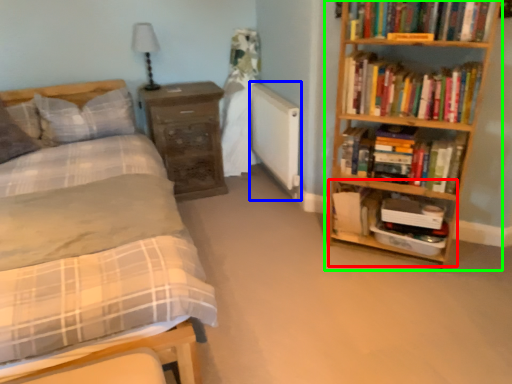
Question: Based on their relative distances, which object is nearer to cabinet (highlighted by a red box)? Choose from radiator (highlighted by a blue box) and bookcase (highlighted by a green box).

Choices:
 (A) radiator
 (B) bookcase

Answer: (B)